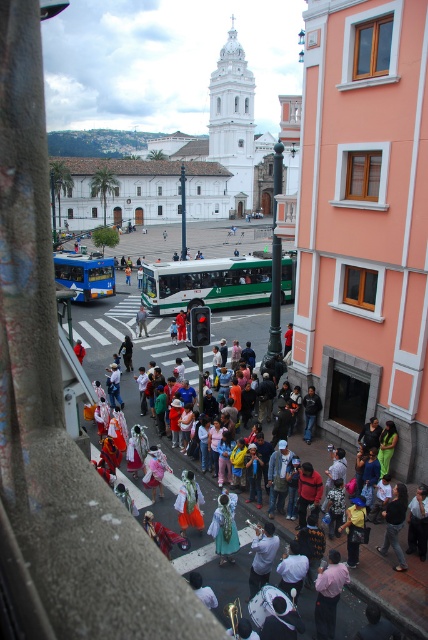
Can you confirm if green matte bus at center is positioned to the left of light brown fabric dress at center?

Yes, green matte bus at center is to the left of light brown fabric dress at center.

Is green matte bus at center in front of light brown fabric dress at center?

That is False.

Measure the distance between green matte bus at center and camera.

The distance of green matte bus at center from camera is 210.99 feet.

The width and height of the screenshot is (428, 640). Identify the location of green matte bus at center. (85, 275).

Who is lower down, light blue shirt at center or white cotton shirt at lower center?

white cotton shirt at lower center is below.

Which is above, light blue shirt at center or white cotton shirt at lower center?

light blue shirt at center is higher up.

Where is `light blue shirt at center`? light blue shirt at center is located at coordinates (261, 556).

Is white/green metallic bus at center below white cotton hat at center?

No, white/green metallic bus at center is not below white cotton hat at center.

In the scene shown: Is white/green metallic bus at center bigger than white cotton hat at center?

Yes, white/green metallic bus at center is bigger than white cotton hat at center.

I want to click on white/green metallic bus at center, so click(205, 284).